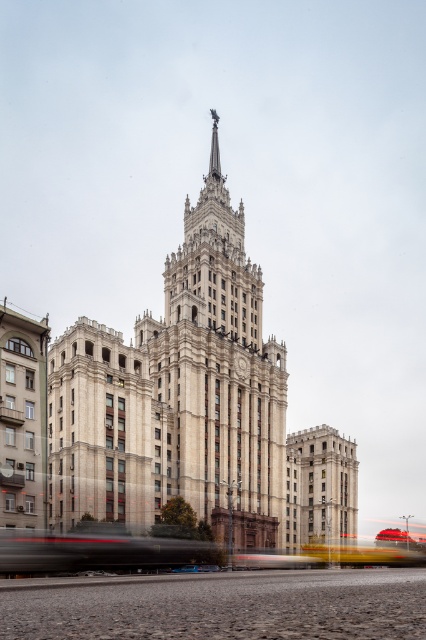
Who is positioned more to the right, white stone church at center or smooth stone tower at center?

smooth stone tower at center

Does point (169, 291) lie in front of point (314, 442)?

Yes, point (169, 291) is in front of point (314, 442).

Identify the location of white stone church at center. This screenshot has height=640, width=426. (195, 406).